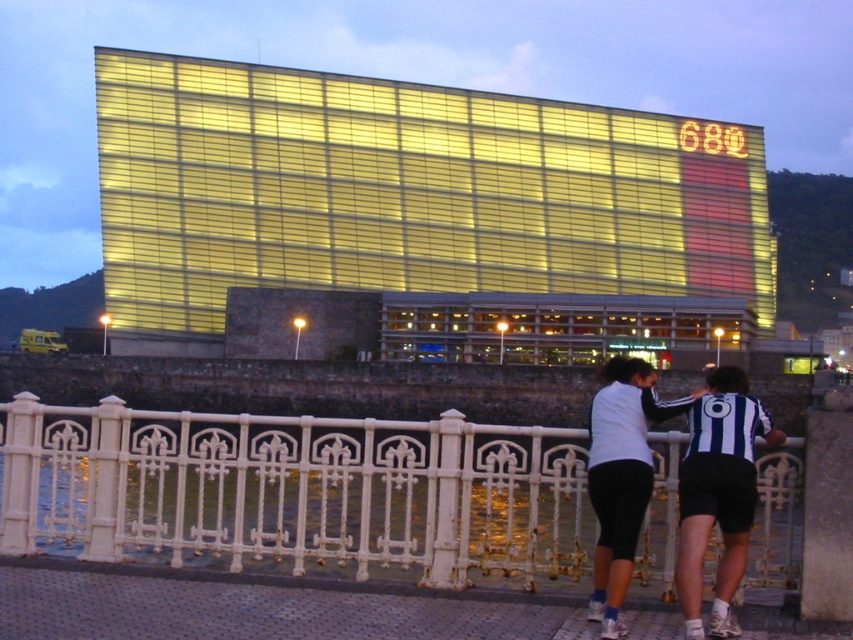
Is white wrought iron fence at lower center behind striped jersey at center?

Yes.

Find the location of a particular element. The image size is (853, 640). white wrought iron fence at lower center is located at coordinates (296, 490).

At what (x,y) coordinates should I click in order to perform the action: click on white wrought iron fence at lower center. Please return your answer as a coordinate pair (x, y). The width and height of the screenshot is (853, 640). Looking at the image, I should click on (296, 490).